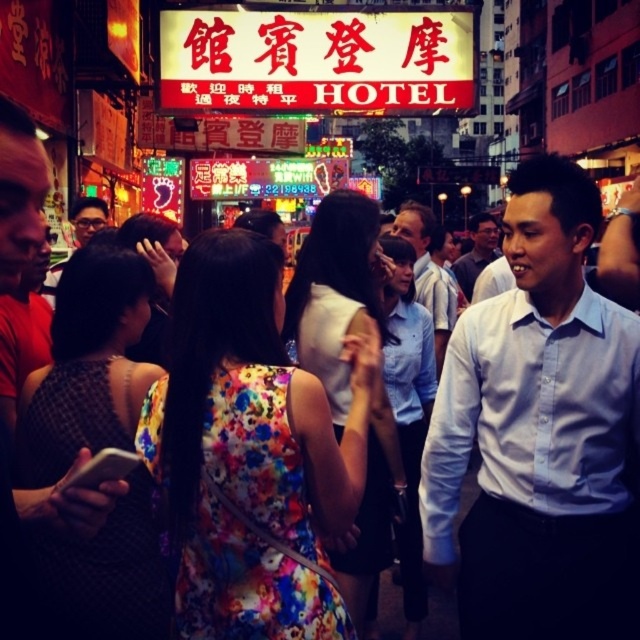
Between red plastic sign at upper center and matte white shirt at center, which one is positioned higher?

red plastic sign at upper center

Can you confirm if red plastic sign at upper center is thinner than matte white shirt at center?

Indeed, red plastic sign at upper center has a lesser width compared to matte white shirt at center.

Where is `red plastic sign at upper center`? red plastic sign at upper center is located at coordinates (316, 60).

The image size is (640, 640). I want to click on red plastic sign at upper center, so click(x=316, y=60).

What are the coordinates of `white cotton shirt at center` in the screenshot? It's located at (540, 433).

Who is shorter, white cotton shirt at center or matte white shirt at center?

With less height is matte white shirt at center.

Is point (550, 438) closer to viewer compared to point (476, 228)?

Yes, it is.

The height and width of the screenshot is (640, 640). Identify the location of white cotton shirt at center. (540, 433).

Does light blue shirt at center appear on the left side of matte white shirt at center?

Yes, light blue shirt at center is to the left of matte white shirt at center.

Which of these two, light blue shirt at center or matte white shirt at center, stands taller?

matte white shirt at center is taller.

Is point (432, 310) farther from camera compared to point (483, 240)?

No, (432, 310) is closer to viewer.

This screenshot has height=640, width=640. I want to click on light blue shirt at center, so click(428, 275).